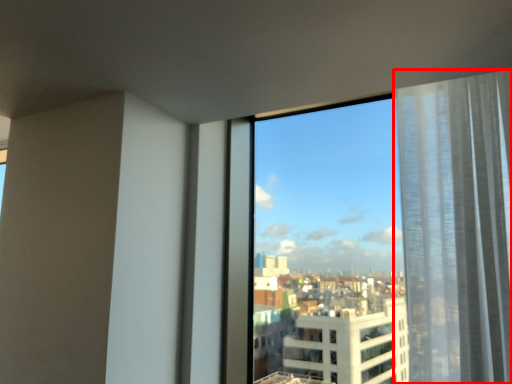
Question: In this image, where is curtain (annotated by the red box) located relative to window?

Choices:
 (A) left
 (B) right

Answer: (B)